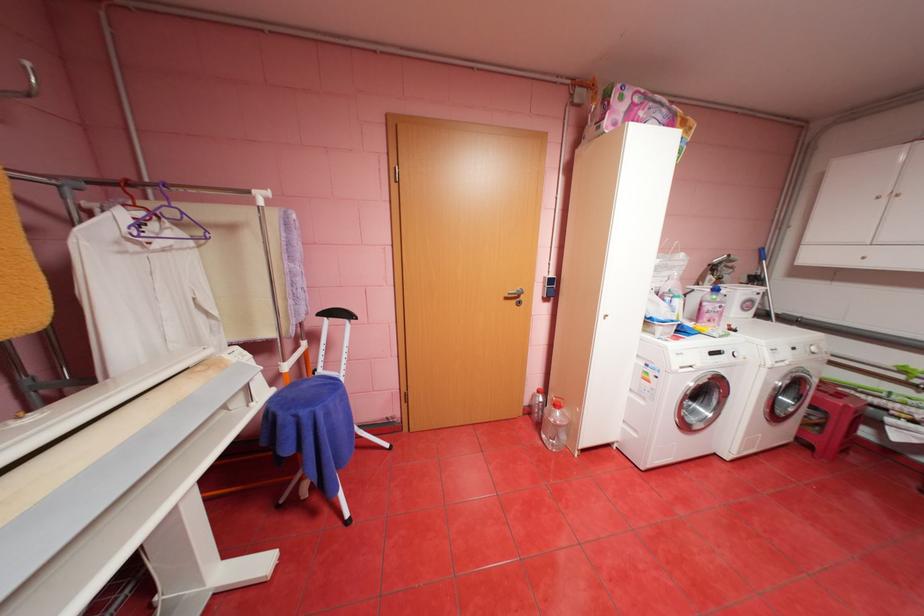
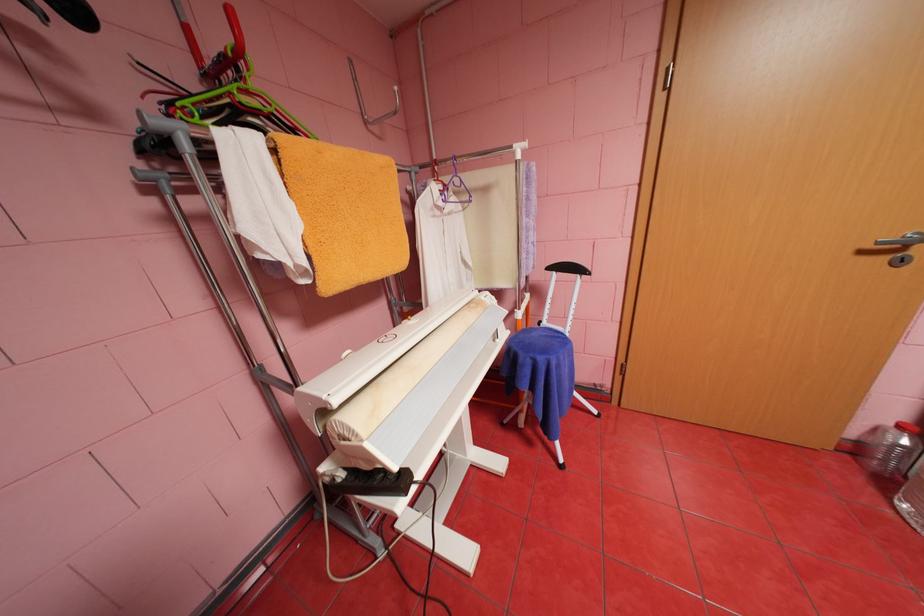
Question: The camera is either moving clockwise (left) or counter-clockwise (right) around the object. The first image is from the beginning of the video and the second image is from the end. Is the camera moving left or right when shooting the video?

Choices:
 (A) Left
 (B) Right

Answer: (B)